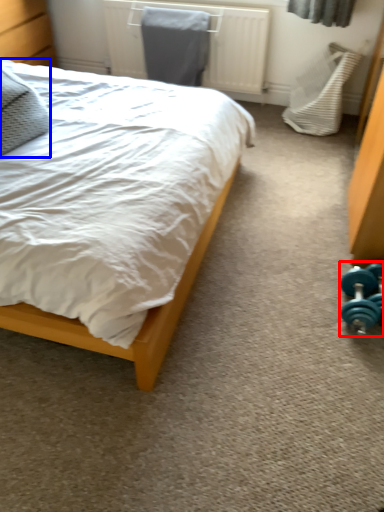
Question: Among these objects, which one is farthest to the camera, dumbbell (highlighted by a red box) or pillow (highlighted by a blue box)?

Choices:
 (A) dumbbell
 (B) pillow

Answer: (A)